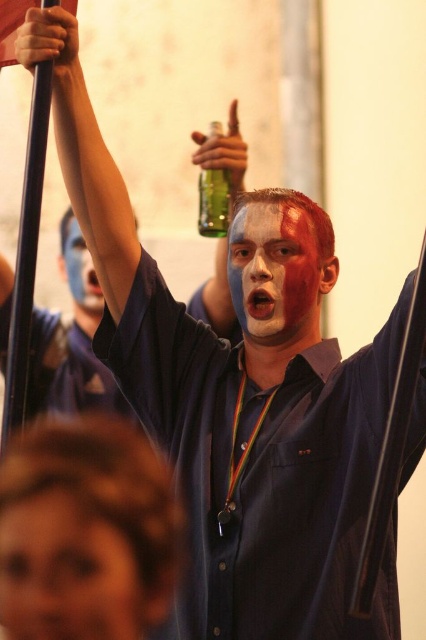
Can you confirm if matte blue face paint at lower left is positioned above painted face at center?

No, matte blue face paint at lower left is not above painted face at center.

The image size is (426, 640). In order to click on matte blue face paint at lower left in this screenshot , I will do click(65, 573).

You are a GUI agent. You are given a task and a screenshot of the screen. Output one action in this format:
    pyautogui.click(x=<x>, y=<y>)
    Task: Click on the matte blue face paint at lower left
    The width and height of the screenshot is (426, 640).
    Given the screenshot: What is the action you would take?
    (x=65, y=573)

Does blue matte face paint at upper center appear under green glass bottle at center?

Indeed, blue matte face paint at upper center is positioned under green glass bottle at center.

Is blue matte face paint at upper center wider than green glass bottle at center?

Yes.

Is point (66, 225) closer to camera compared to point (227, 227)?

No, (66, 225) is behind (227, 227).

At what (x,y) coordinates should I click in order to perform the action: click on blue matte face paint at upper center. Please return your answer as a coordinate pair (x, y). Looking at the image, I should click on (80, 269).

Is painted face at center wider than green glass bottle at center?

Yes, painted face at center is wider than green glass bottle at center.

Between point (267, 273) and point (219, 216), which one is positioned behind?

Positioned behind is point (219, 216).

Image resolution: width=426 pixels, height=640 pixels. In order to click on painted face at center in this screenshot , I will do `click(275, 273)`.